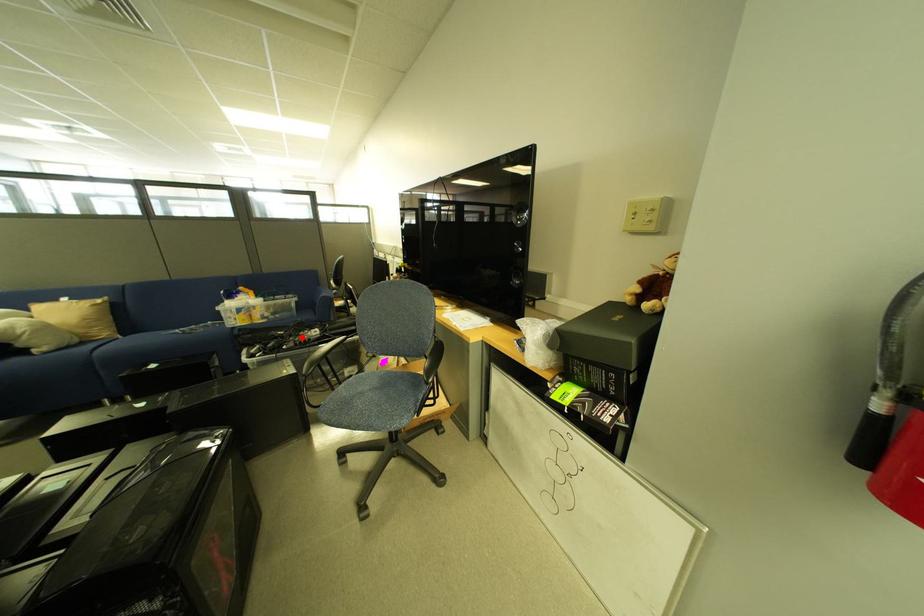
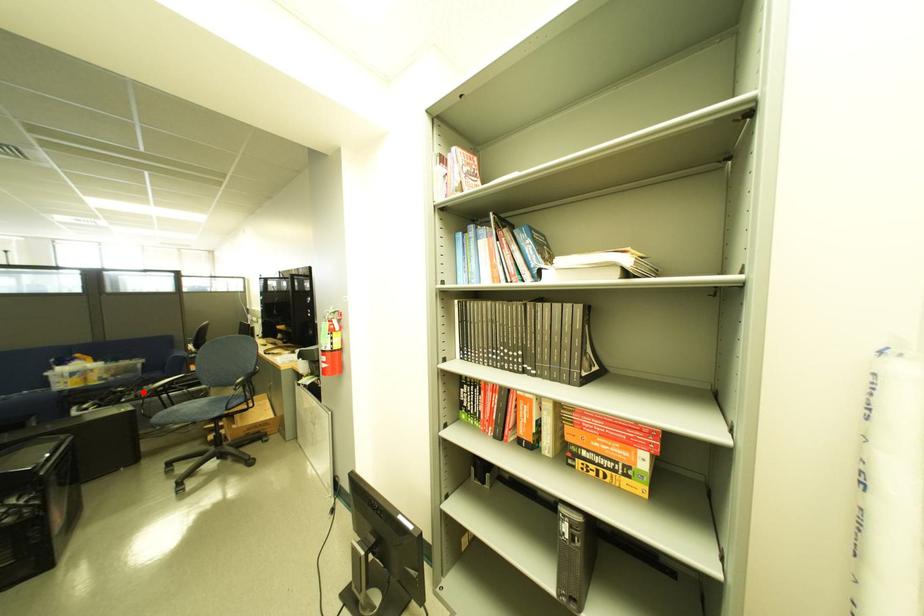
I am providing you with two images of the same scene from different viewpoints. A red point is marked on the first image and another point is marked on the second image. Does the point marked in image1 correspond to the same location as the one in image2?

Yes